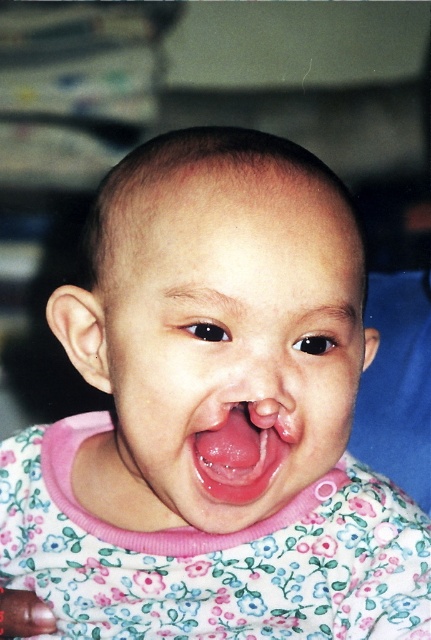
Question: Considering the relative positions of pink fabric face at center and pink flesh-colored tongue at center in the image provided, where is pink fabric face at center located with respect to pink flesh-colored tongue at center?

Choices:
 (A) above
 (B) below

Answer: (A)

Question: Which point is closer to the camera?

Choices:
 (A) pink flesh-colored tongue at center
 (B) pink fabric face at center

Answer: (B)

Question: Is the position of pink fabric face at center less distant than that of pink flesh-colored tongue at center?

Choices:
 (A) no
 (B) yes

Answer: (B)

Question: Does pink fabric face at center have a larger size compared to pink flesh-colored tongue at center?

Choices:
 (A) yes
 (B) no

Answer: (A)